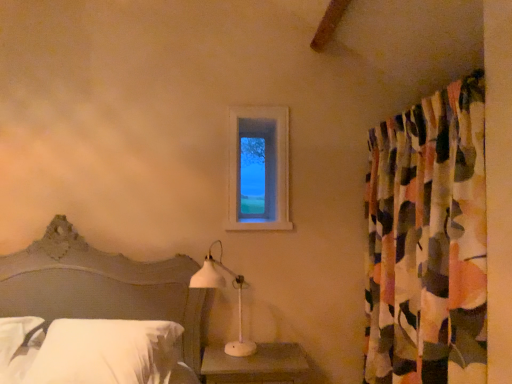
Question: From a real-world perspective, relative to multicolored fabric curtain at right, is white soft pillow at lower left vertically above or below?

Choices:
 (A) above
 (B) below

Answer: (B)

Question: Which is correct: white soft pillow at lower left is inside multicolored fabric curtain at right, or outside of it?

Choices:
 (A) outside
 (B) inside

Answer: (A)

Question: Which of these objects is positioned closest to the white plastic table lamp at lower center?

Choices:
 (A) white soft pillow at lower left
 (B) matte white wood nightstand at lower center
 (C) multicolored fabric curtain at right
 (D) clear glass window at upper center
 (E) matte gray headboard at lower left

Answer: (B)

Question: Which object is the closest to the matte white wood nightstand at lower center?

Choices:
 (A) white soft pillow at lower left
 (B) white plastic table lamp at lower center
 (C) multicolored fabric curtain at right
 (D) clear glass window at upper center
 (E) matte gray headboard at lower left

Answer: (B)